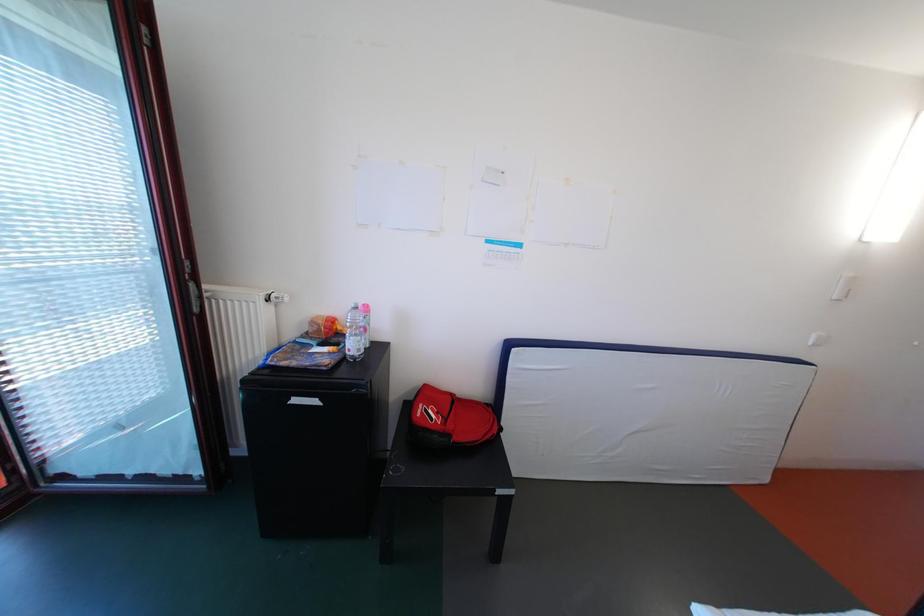
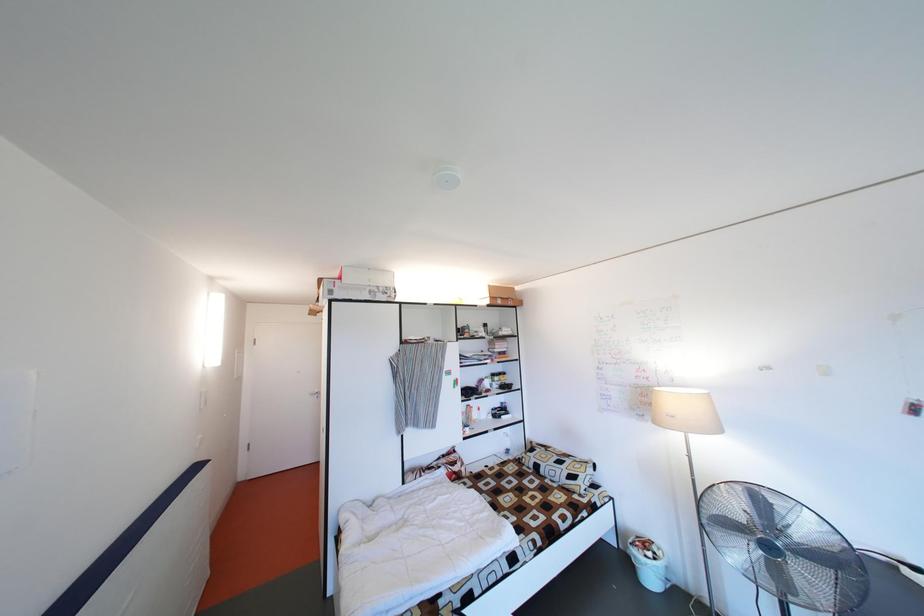
Question: The camera is either moving clockwise (left) or counter-clockwise (right) around the object. The first image is from the beginning of the video and the second image is from the end. Is the camera moving left or right when shooting the video?

Choices:
 (A) Left
 (B) Right

Answer: (A)